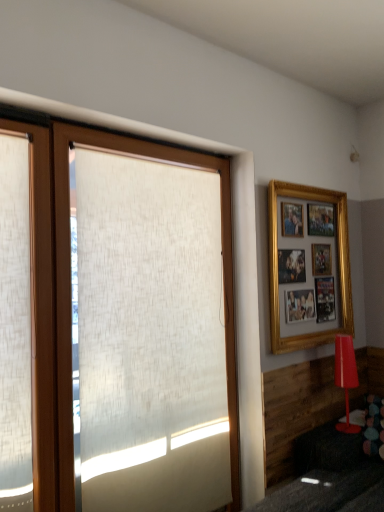
This screenshot has height=512, width=384. I want to click on free space above white textured roller blind at left (from a real-world perspective), so click(x=153, y=141).